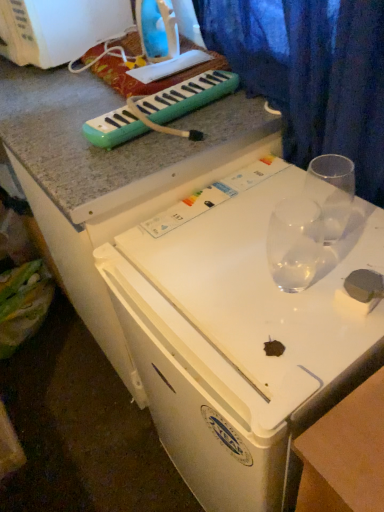
What is the approximate width of transparent glass at upper right, which is the first martini glass in right-to-left order?

The width of transparent glass at upper right, which is the first martini glass in right-to-left order, is 4.05 inches.

Locate an element on the screen. matte plastic iron at upper center, placed as the second appliance when sorted from left to right is located at coordinates (157, 29).

Locate an element on the screen. This screenshot has width=384, height=512. white plastic washing machine at upper left, marked as the second appliance in a right-to-left arrangement is located at coordinates (58, 28).

The width and height of the screenshot is (384, 512). I want to click on blue fabric curtain at upper right, so click(x=311, y=74).

Locate an element on the screen. transparent glass at upper right, which is the first martini glass in right-to-left order is located at coordinates (332, 191).

Identify the location of musical keyboard on the left of clear glass martini glass at center, the 1th martini glass in the left-to-right sequence. This screenshot has width=384, height=512. (188, 96).

Does clear glass martini glass at center, the 1th martini glass in the left-to-right sequence, turn towards green plastic melodica at upper center?

No, clear glass martini glass at center, the 1th martini glass in the left-to-right sequence, does not turn towards green plastic melodica at upper center.

Looking at this image, which object is closer to the camera taking this photo, clear glass martini glass at center, the 1th martini glass in the left-to-right sequence, or green plastic melodica at upper center?

clear glass martini glass at center, the 1th martini glass in the left-to-right sequence, is closer to the camera.

Looking at this image, from a real-world perspective, which object rests below the other?

clear glass martini glass at center, the 2th martini glass positioned from the right, is physically lower.

Identify the location of musical keyboard lying in front of the white plastic washing machine at upper left, which is the 1th appliance from left to right. The height and width of the screenshot is (512, 384). (188, 96).

From a real-world perspective, relative to white plastic washing machine at upper left, which is the 1th appliance from left to right, is green plastic melodica at upper center vertically above or below?

Clearly, from a real-world perspective, green plastic melodica at upper center is below white plastic washing machine at upper left, which is the 1th appliance from left to right.

Is green plastic melodica at upper center at the left side of white plastic washing machine at upper left, marked as the second appliance in a right-to-left arrangement?

No, green plastic melodica at upper center is not to the left of white plastic washing machine at upper left, marked as the second appliance in a right-to-left arrangement.

Can white plastic washing machine at upper left, which is the 1th appliance from left to right, be found inside green plastic melodica at upper center?

Definitely not — white plastic washing machine at upper left, which is the 1th appliance from left to right, is not inside green plastic melodica at upper center.

Which object is more forward, matte plastic iron at upper center, which is the first appliance from right to left, or white plastic washing machine at upper left, which is the 1th appliance from left to right?

Positioned in front is matte plastic iron at upper center, which is the first appliance from right to left.

Is matte plastic iron at upper center, placed as the second appliance when sorted from left to right, oriented away from white plastic washing machine at upper left, marked as the second appliance in a right-to-left arrangement?

No.

Consider the image. Can you confirm if matte plastic iron at upper center, placed as the second appliance when sorted from left to right, is shorter than white plastic washing machine at upper left, marked as the second appliance in a right-to-left arrangement?

No, matte plastic iron at upper center, placed as the second appliance when sorted from left to right, is not shorter than white plastic washing machine at upper left, marked as the second appliance in a right-to-left arrangement.

Can you tell me how much white plastic washing machine at upper left, which is the 1th appliance from left to right, and blue fabric curtain at upper right differ in facing direction?

8.33 degrees.

From the image's perspective, which appliance is the 2nd one above the blue fabric curtain at upper right? Please provide its 2D coordinates.

[(58, 28)]

Which object is closer to the camera, white plastic washing machine at upper left, marked as the second appliance in a right-to-left arrangement, or blue fabric curtain at upper right?

blue fabric curtain at upper right is in front.

Is white plastic washing machine at upper left, which is the 1th appliance from left to right, next to blue fabric curtain at upper right?

No, white plastic washing machine at upper left, which is the 1th appliance from left to right, is not making contact with blue fabric curtain at upper right.

Which of these two, transparent glass at upper right, which is the first martini glass in right-to-left order, or white plastic washing machine at upper left, which is the 1th appliance from left to right, stands shorter?

transparent glass at upper right, which is the first martini glass in right-to-left order.

Considering the positions of points (337, 233) and (40, 7), is point (337, 233) farther from camera compared to point (40, 7)?

No.

The width and height of the screenshot is (384, 512). I want to click on martini glass that is the 1st object located in front of the white plastic washing machine at upper left, which is the 1th appliance from left to right, so pos(332,191).

Between transparent glass at upper right, which is the first martini glass in right-to-left order, and white plastic washing machine at upper left, marked as the second appliance in a right-to-left arrangement, which one has smaller size?

With smaller size is transparent glass at upper right, which is the first martini glass in right-to-left order.

Is blue fabric curtain at upper right facing away from transparent glass at upper right, the 2th martini glass viewed from the left?

blue fabric curtain at upper right does not have its back to transparent glass at upper right, the 2th martini glass viewed from the left.

In the scene shown: Between blue fabric curtain at upper right and transparent glass at upper right, the 2th martini glass viewed from the left, which one has larger width?

Wider between the two is blue fabric curtain at upper right.

Considering the relative sizes of blue fabric curtain at upper right and transparent glass at upper right, the 2th martini glass viewed from the left, in the image provided, is blue fabric curtain at upper right taller than transparent glass at upper right, the 2th martini glass viewed from the left,?

Correct, blue fabric curtain at upper right is much taller as transparent glass at upper right, the 2th martini glass viewed from the left.

Does matte plastic iron at upper center, placed as the second appliance when sorted from left to right, have a lesser height compared to transparent glass at upper right, the 2th martini glass viewed from the left?

Incorrect, the height of matte plastic iron at upper center, placed as the second appliance when sorted from left to right, does not fall short of that of transparent glass at upper right, the 2th martini glass viewed from the left.

In the scene shown: From the image's perspective, does matte plastic iron at upper center, placed as the second appliance when sorted from left to right, appear lower than transparent glass at upper right, the 2th martini glass viewed from the left?

Actually, matte plastic iron at upper center, placed as the second appliance when sorted from left to right, appears above transparent glass at upper right, the 2th martini glass viewed from the left, in the image.

From the picture: Is matte plastic iron at upper center, which is the first appliance from right to left, facing away from transparent glass at upper right, which is the first martini glass in right-to-left order?

matte plastic iron at upper center, which is the first appliance from right to left, is not turned away from transparent glass at upper right, which is the first martini glass in right-to-left order.

Can you confirm if matte plastic iron at upper center, which is the first appliance from right to left, is smaller than transparent glass at upper right, the 2th martini glass viewed from the left?

Incorrect, matte plastic iron at upper center, which is the first appliance from right to left, is not smaller in size than transparent glass at upper right, the 2th martini glass viewed from the left.

Where is `the 2nd martini glass below the green plastic melodica at upper center (from the image's perspective)`? the 2nd martini glass below the green plastic melodica at upper center (from the image's perspective) is located at coordinates (294, 243).

Starting from the green plastic melodica at upper center, which appliance is the 2nd one behind? Please provide its 2D coordinates.

[(58, 28)]

Which object lies nearer to the anchor point green plastic melodica at upper center, transparent glass at upper right, the 2th martini glass viewed from the left, or matte plastic iron at upper center, which is the first appliance from right to left?

The object closer to green plastic melodica at upper center is matte plastic iron at upper center, which is the first appliance from right to left.

Looking at this image, from the image, which object appears to be nearer to transparent glass at upper right, the 2th martini glass viewed from the left, matte plastic iron at upper center, placed as the second appliance when sorted from left to right, or clear glass martini glass at center, the 2th martini glass positioned from the right?

Among the two, clear glass martini glass at center, the 2th martini glass positioned from the right, is located nearer to transparent glass at upper right, the 2th martini glass viewed from the left.

Estimate the real-world distances between objects in this image. Which object is further from blue fabric curtain at upper right, transparent glass at upper right, which is the first martini glass in right-to-left order, or white plastic washing machine at upper left, marked as the second appliance in a right-to-left arrangement?

The object further to blue fabric curtain at upper right is white plastic washing machine at upper left, marked as the second appliance in a right-to-left arrangement.

From the picture: When comparing their distances from green plastic melodica at upper center, does matte plastic iron at upper center, which is the first appliance from right to left, or blue fabric curtain at upper right seem closer?

The object closer to green plastic melodica at upper center is blue fabric curtain at upper right.

Considering their positions, is clear glass martini glass at center, the 1th martini glass in the left-to-right sequence, positioned closer to white plastic washing machine at upper left, which is the 1th appliance from left to right, than blue fabric curtain at upper right?

blue fabric curtain at upper right is closer to white plastic washing machine at upper left, which is the 1th appliance from left to right.

Which object lies nearer to the anchor point blue fabric curtain at upper right, green plastic melodica at upper center or clear glass martini glass at center, the 2th martini glass positioned from the right?

The object closer to blue fabric curtain at upper right is green plastic melodica at upper center.

Looking at the image, which one is located further to clear glass martini glass at center, the 1th martini glass in the left-to-right sequence, matte plastic iron at upper center, which is the first appliance from right to left, or blue fabric curtain at upper right?

matte plastic iron at upper center, which is the first appliance from right to left, is positioned further to the anchor clear glass martini glass at center, the 1th martini glass in the left-to-right sequence.

Which object lies nearer to the anchor point transparent glass at upper right, which is the first martini glass in right-to-left order, blue fabric curtain at upper right or clear glass martini glass at center, the 2th martini glass positioned from the right?

The object closer to transparent glass at upper right, which is the first martini glass in right-to-left order, is clear glass martini glass at center, the 2th martini glass positioned from the right.

The image size is (384, 512). Identify the location of appliance between white plastic washing machine at upper left, marked as the second appliance in a right-to-left arrangement, and transparent glass at upper right, the 2th martini glass viewed from the left, from top to bottom. (157, 29).

Identify the location of martini glass between blue fabric curtain at upper right and clear glass martini glass at center, the 2th martini glass positioned from the right, vertically. coord(332,191).

Identify the location of musical keyboard situated between white plastic washing machine at upper left, marked as the second appliance in a right-to-left arrangement, and blue fabric curtain at upper right from left to right. (188, 96).

At what (x,y) coordinates should I click in order to perform the action: click on musical keyboard between blue fabric curtain at upper right and transparent glass at upper right, the 2th martini glass viewed from the left, vertically. Please return your answer as a coordinate pair (x, y). Image resolution: width=384 pixels, height=512 pixels. Looking at the image, I should click on (188, 96).